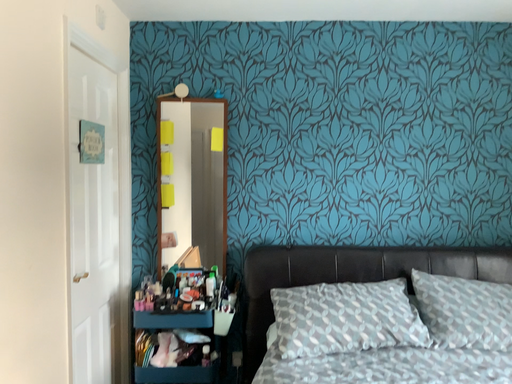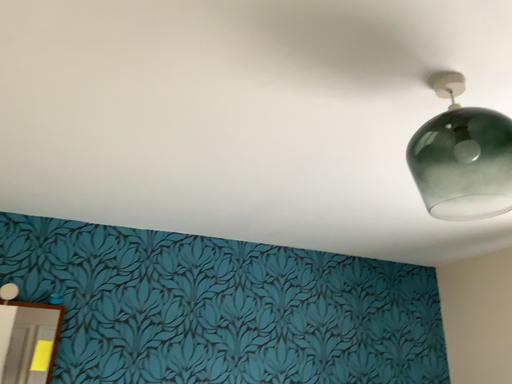
Question: How did the camera likely rotate when shooting the video?

Choices:
 (A) rotated upward
 (B) rotated downward

Answer: (A)